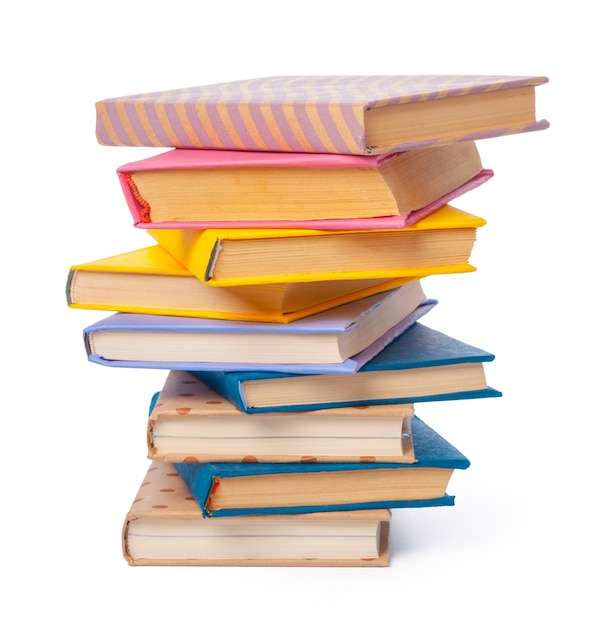
The image size is (595, 626). Identify the location of books. (397, 116), (320, 195), (320, 247), (258, 299), (268, 344), (295, 394), (256, 433), (277, 491), (220, 546).